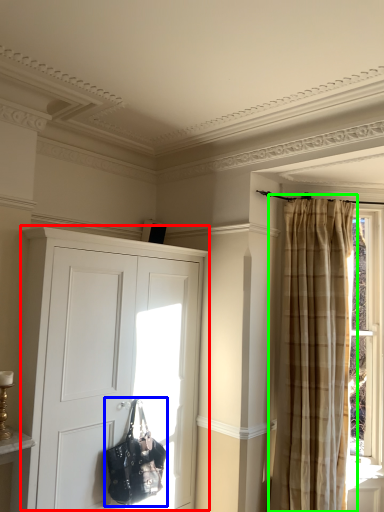
Question: Estimate the real-world distances between objects in this image. Which object is farther from cupboard (highlighted by a red box), handbag (highlighted by a blue box) or curtain (highlighted by a green box)?

Choices:
 (A) handbag
 (B) curtain

Answer: (B)